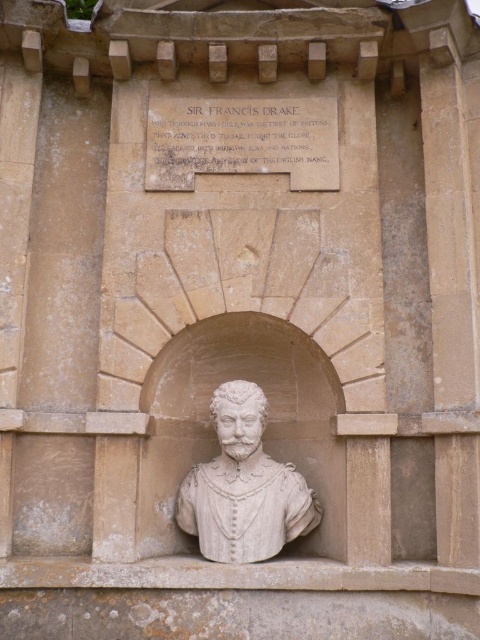
Locate an element on the screen. This screenshot has width=480, height=640. matte stone plaque at upper center is located at coordinates (241, 140).

Is point (326, 100) more distant than point (280, 492)?

Yes, it is behind point (280, 492).

The width and height of the screenshot is (480, 640). What are the coordinates of `matte stone plaque at upper center` in the screenshot? It's located at (241, 140).